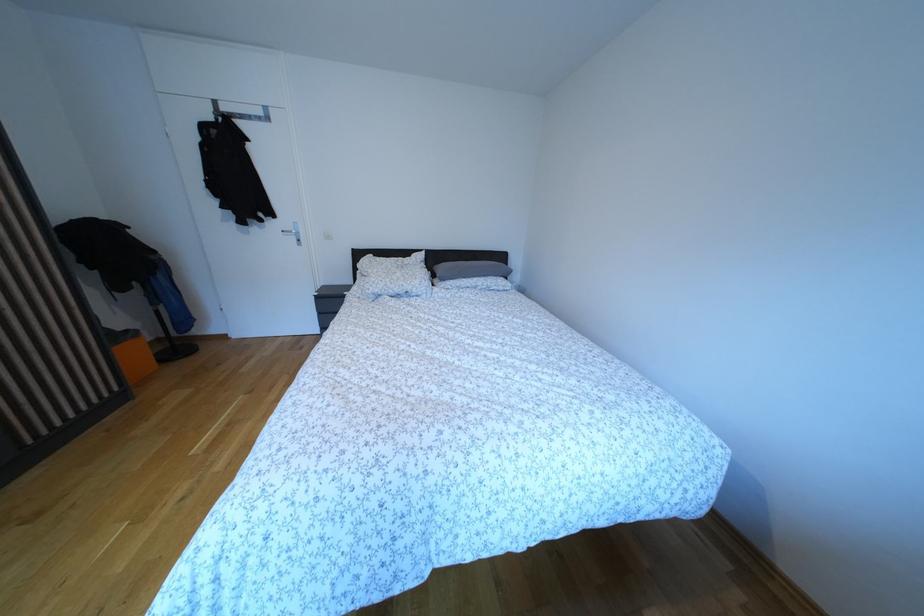
Where is `silver door handle`? This screenshot has height=616, width=924. silver door handle is located at coordinates (289, 232).